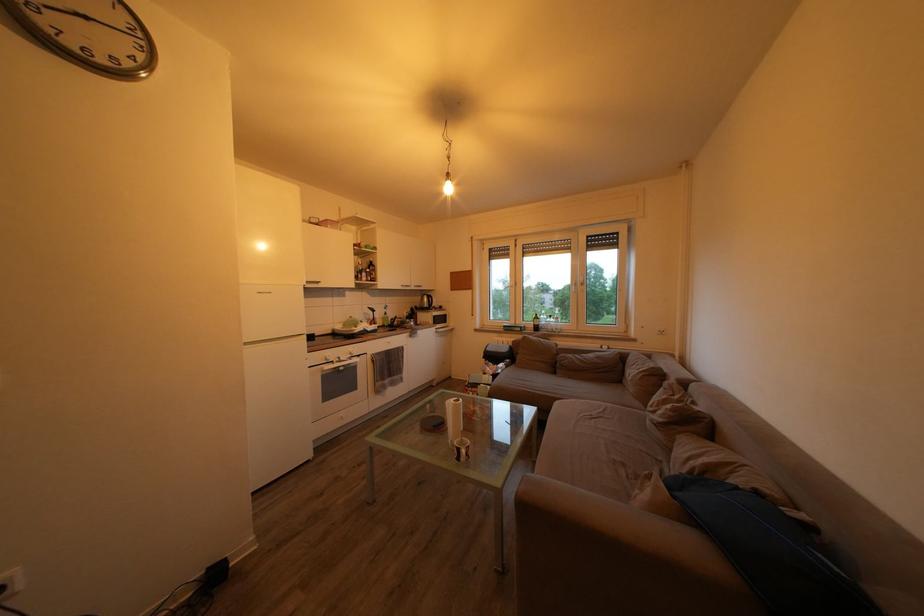
This screenshot has height=616, width=924. Describe the element at coordinates (90, 34) in the screenshot. I see `the microwave dial` at that location.